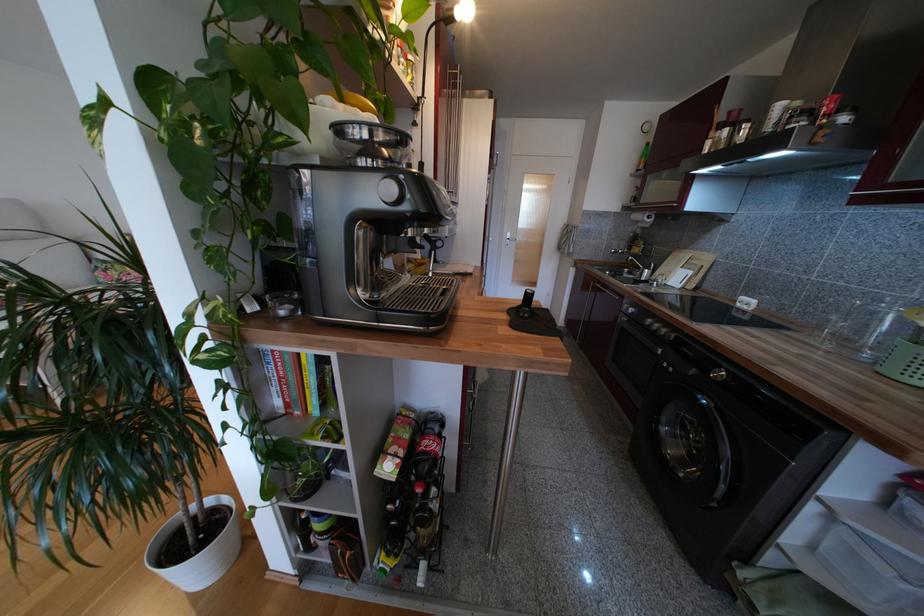
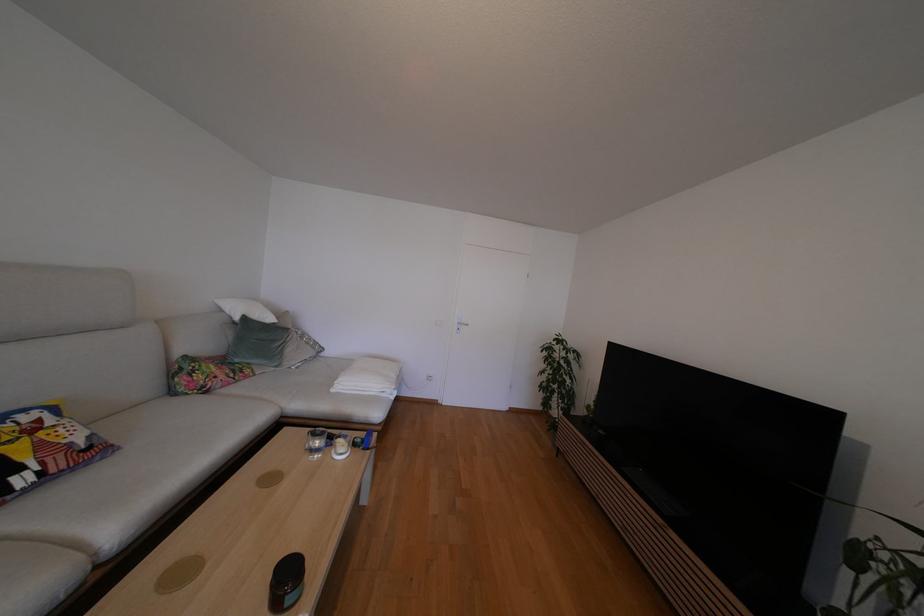
Question: What movement of the cameraman would produce the second image?

Choices:
 (A) Left
 (B) Right
 (C) Forward
 (D) Backward

Answer: (A)